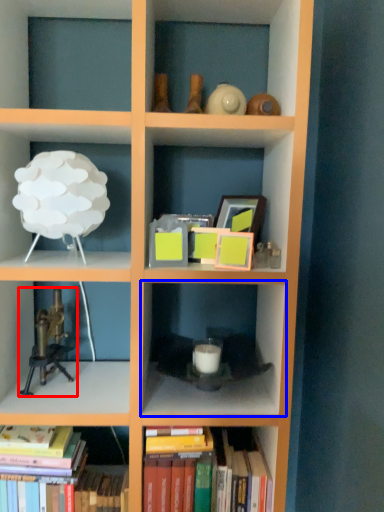
Question: Which of the following is the farthest to the observer, toy (highlighted by a red box) or shelf (highlighted by a blue box)?

Choices:
 (A) toy
 (B) shelf

Answer: (A)